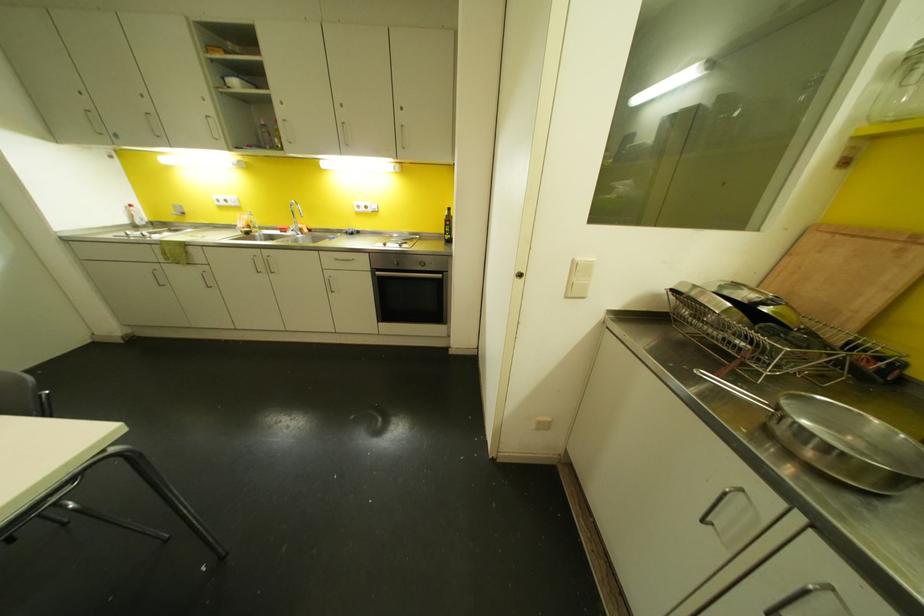
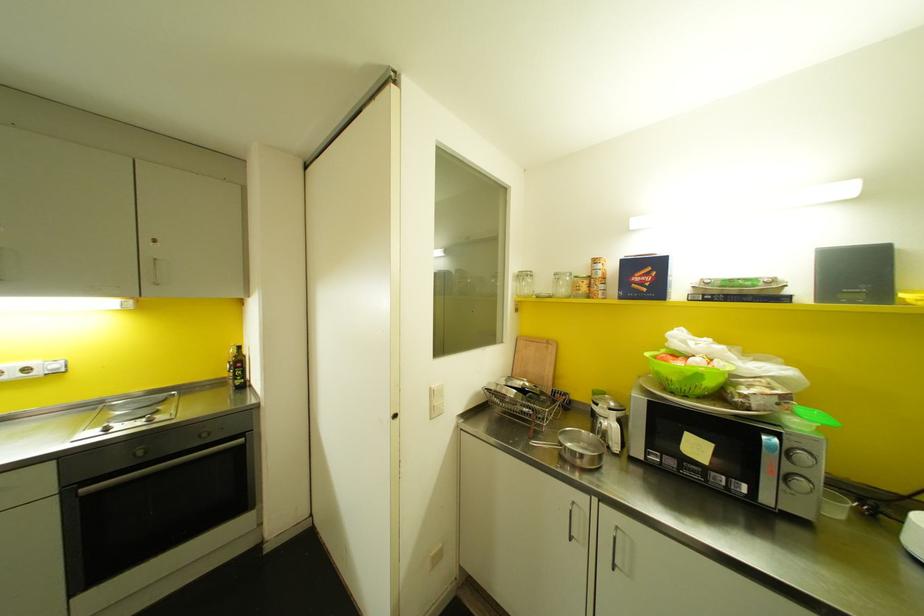
Find the pixel in the second image that matches pixel 395 262 in the first image.

(140, 451)